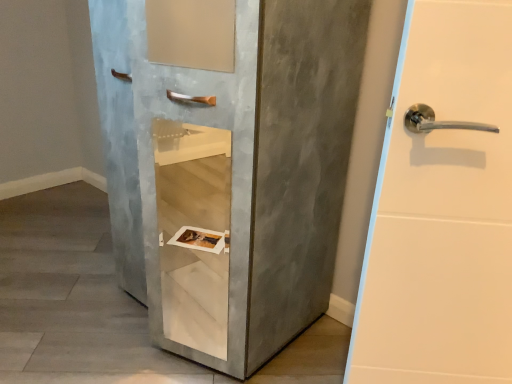
The image size is (512, 384). In order to click on matte gray cabinet at center in this screenshot , I will do `click(230, 164)`.

What do you see at coordinates (230, 164) in the screenshot? Image resolution: width=512 pixels, height=384 pixels. I see `matte gray cabinet at center` at bounding box center [230, 164].

Locate an element on the screen. concrete textured cabinet at center is located at coordinates (73, 299).

Measure the distance between concrete textured cabinet at center and camera.

concrete textured cabinet at center is 1.41 meters away from camera.

The image size is (512, 384). What do you see at coordinates (73, 299) in the screenshot? I see `concrete textured cabinet at center` at bounding box center [73, 299].

This screenshot has height=384, width=512. I want to click on matte gray cabinet at center, so click(x=230, y=164).

Between matte gray cabinet at center and concrete textured cabinet at center, which one appears on the right side from the viewer's perspective?

Positioned to the right is matte gray cabinet at center.

In the image, is matte gray cabinet at center positioned in front of or behind concrete textured cabinet at center?

Clearly, matte gray cabinet at center is in front of concrete textured cabinet at center.

Between point (138, 129) and point (335, 373), which one is positioned in front?

The point (138, 129) is more forward.

Looking at this image, from the image's perspective, relative to concrete textured cabinet at center, is matte gray cabinet at center above or below?

From the image's perspective, matte gray cabinet at center appears above concrete textured cabinet at center.

Based on the photo, from a real-world perspective, which object stands above the other?

matte gray cabinet at center.

Considering the sizes of matte gray cabinet at center and concrete textured cabinet at center in the image, is matte gray cabinet at center wider or thinner than concrete textured cabinet at center?

Clearly, matte gray cabinet at center has less width compared to concrete textured cabinet at center.

Considering the relative sizes of matte gray cabinet at center and concrete textured cabinet at center in the image provided, is matte gray cabinet at center shorter than concrete textured cabinet at center?

In fact, matte gray cabinet at center may be taller than concrete textured cabinet at center.

Is matte gray cabinet at center bigger than concrete textured cabinet at center?

Correct, matte gray cabinet at center is larger in size than concrete textured cabinet at center.

Is matte gray cabinet at center spatially inside concrete textured cabinet at center, or outside of it?

matte gray cabinet at center cannot be found inside concrete textured cabinet at center.

Are matte gray cabinet at center and concrete textured cabinet at center far apart?

No, matte gray cabinet at center is in close proximity to concrete textured cabinet at center.

Is matte gray cabinet at center looking in the opposite direction of concrete textured cabinet at center?

That's not correct — matte gray cabinet at center is not looking away from concrete textured cabinet at center.

At what (x,y) coordinates should I click in order to perform the action: click on concrete below the matte gray cabinet at center (from the image's perspective). Please return your answer as a coordinate pair (x, y). The width and height of the screenshot is (512, 384). Looking at the image, I should click on click(73, 299).

Considering the relative positions of concrete textured cabinet at center and matte gray cabinet at center in the image provided, is concrete textured cabinet at center to the left of matte gray cabinet at center from the viewer's perspective?

Correct, you'll find concrete textured cabinet at center to the left of matte gray cabinet at center.

Which object is further away from the camera, concrete textured cabinet at center or matte gray cabinet at center?

concrete textured cabinet at center.

Does point (82, 286) come closer to viewer compared to point (257, 150)?

That is False.

From the image's perspective, relative to matte gray cabinet at center, is concrete textured cabinet at center above or below?

From the image's perspective, concrete textured cabinet at center appears below matte gray cabinet at center.

Consider the image. From a real-world perspective, which object rests below the other?

concrete textured cabinet at center.

Is concrete textured cabinet at center thinner than matte gray cabinet at center?

No, concrete textured cabinet at center is not thinner than matte gray cabinet at center.

Which of these two, concrete textured cabinet at center or matte gray cabinet at center, stands shorter?

With less height is concrete textured cabinet at center.

Is concrete textured cabinet at center smaller than matte gray cabinet at center?

Yes, concrete textured cabinet at center is smaller than matte gray cabinet at center.

Is concrete textured cabinet at center completely or partially outside of matte gray cabinet at center?

Yes, concrete textured cabinet at center is not within matte gray cabinet at center.

Are concrete textured cabinet at center and matte gray cabinet at center located far from each other?

Actually, concrete textured cabinet at center and matte gray cabinet at center are a little close together.

Is concrete textured cabinet at center oriented towards matte gray cabinet at center?

No.

How distant is concrete textured cabinet at center from matte gray cabinet at center?

concrete textured cabinet at center and matte gray cabinet at center are 22.08 inches apart from each other.

Locate an element on the screen. This screenshot has width=512, height=384. concrete below the matte gray cabinet at center (from a real-world perspective) is located at coordinates (73, 299).

Identify the location of door above the concrete textured cabinet at center (from a real-world perspective). (230, 164).

Where is `concrete on the left of the matte gray cabinet at center`? concrete on the left of the matte gray cabinet at center is located at coordinates (73, 299).